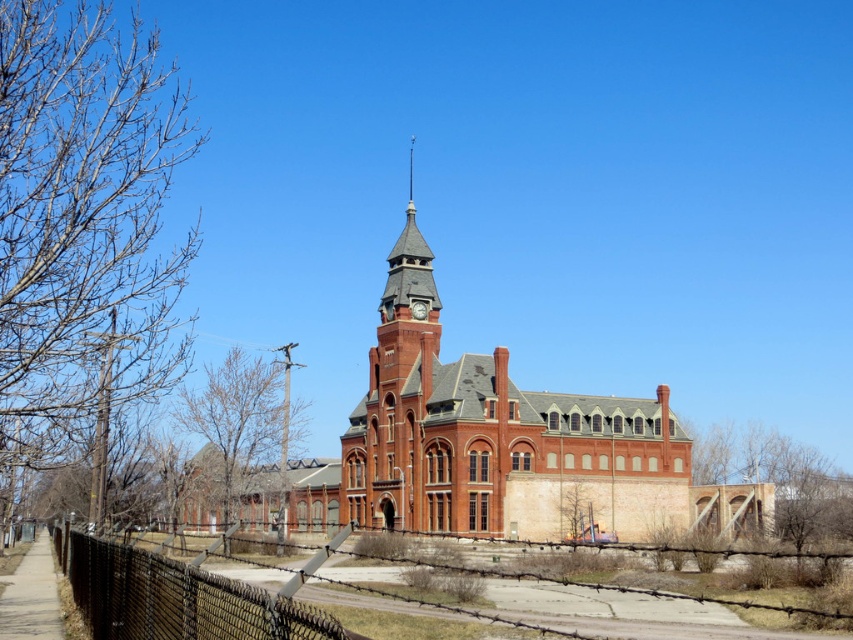
You are standing in front of the historic red brick building with the clock tower. If you want to take a photo that includes both the red brick church at center and the chain link fence with barbed wire, where should you position yourself relative to the church?

Since the red brick church at center is located at point (503, 444), you should position yourself in front of the church to include both it and the chain link fence in your photo.

You are standing at the point with coordinates (x=177, y=596) in the image. What object is located at that point?

The black chainlink fence at lower left is located at point (x=177, y=596).